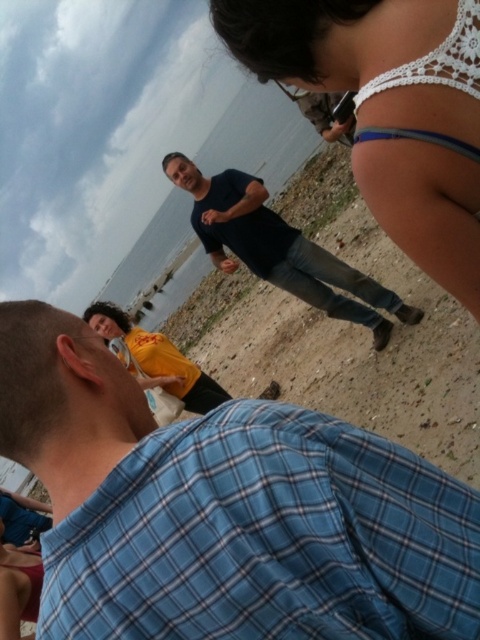
Is brown sandy beach at center bigger than yellow t-shirt at lower left?

Yes, brown sandy beach at center is bigger than yellow t-shirt at lower left.

Is point (373, 275) positioned in front of point (182, 388)?

No, (373, 275) is behind (182, 388).

This screenshot has height=640, width=480. In order to click on brown sandy beach at center in this screenshot , I will do `click(351, 349)`.

Which of these two, brown sandy beach at center or dark blue shirt at center, stands shorter?

Standing shorter between the two is dark blue shirt at center.

Is point (381, 356) farther from viewer compared to point (320, 289)?

No, it is not.

Where is `brown sandy beach at center`? brown sandy beach at center is located at coordinates (351, 349).

Which is below, dark blue shirt at center or yellow t-shirt at lower left?

yellow t-shirt at lower left

Which is behind, point (304, 284) or point (192, 369)?

Positioned behind is point (192, 369).

You are a GUI agent. You are given a task and a screenshot of the screen. Output one action in this format:
    pyautogui.click(x=<x>, y=<y>)
    Task: Click on the dark blue shirt at center
    This screenshot has height=640, width=480.
    Given the screenshot: What is the action you would take?
    pos(279,248)